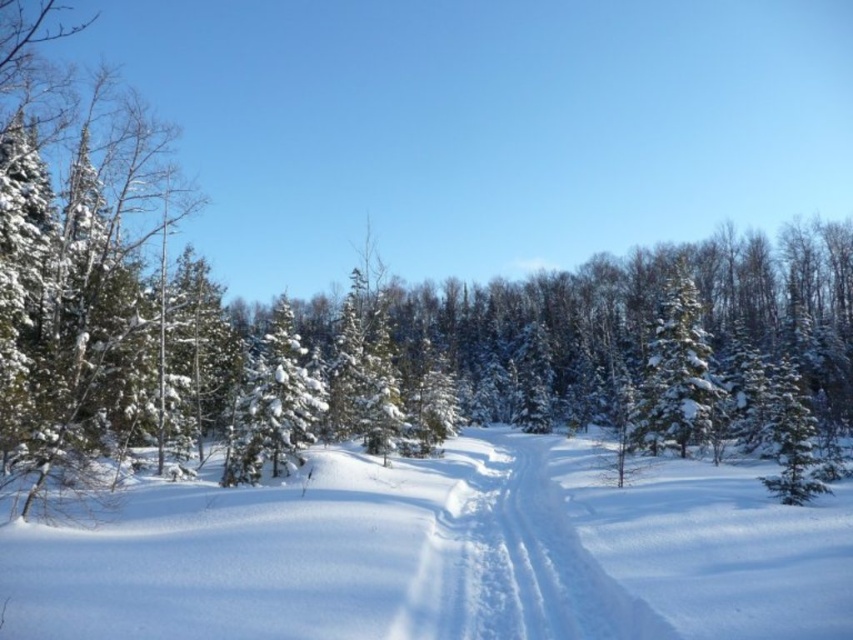
You are planning to walk on the white fluffy snow at center and the white powdery snow trail at center. Which surface will you sink deeper into?

The white fluffy snow at center has a greater width than the white powdery snow trail at center, so you will sink deeper into the white fluffy snow at center.

You are a snowmobile rider planning to cross the white fluffy snow at center and the white powdery snow trail at center. Which surface would you choose for better traction and why?

The white powdery snow trail at center would provide better traction because it is positioned on the right side of the white fluffy snow at center, which might be deeper or looser, making it harder to traverse.